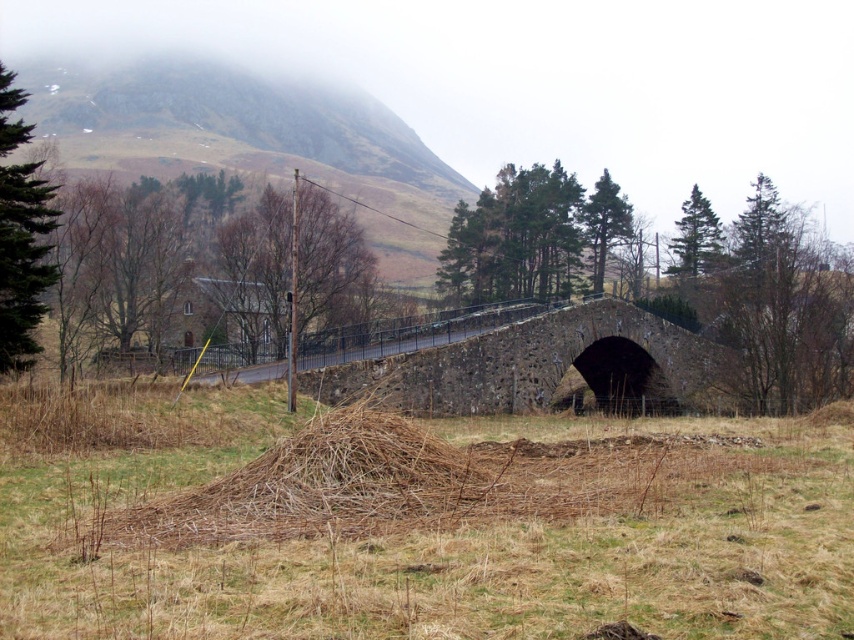
Question: Considering the relative positions of brown dry grass at lower center and stone bridge at center in the image provided, where is brown dry grass at lower center located with respect to stone bridge at center?

Choices:
 (A) left
 (B) right

Answer: (A)

Question: Which object appears closest to the camera in this image?

Choices:
 (A) stone bridge at center
 (B) brown dry grass at lower center

Answer: (B)

Question: Does brown dry grass at lower center lie behind stone bridge at center?

Choices:
 (A) no
 (B) yes

Answer: (A)

Question: Which point appears farthest from the camera in this image?

Choices:
 (A) (685, 372)
 (B) (580, 538)

Answer: (A)

Question: Can you confirm if brown dry grass at lower center is smaller than stone bridge at center?

Choices:
 (A) yes
 (B) no

Answer: (A)